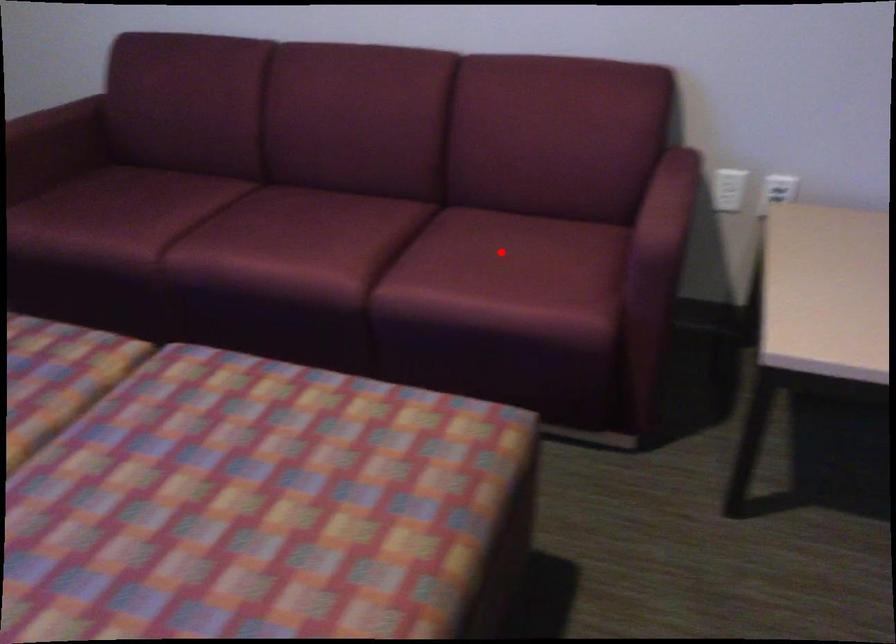
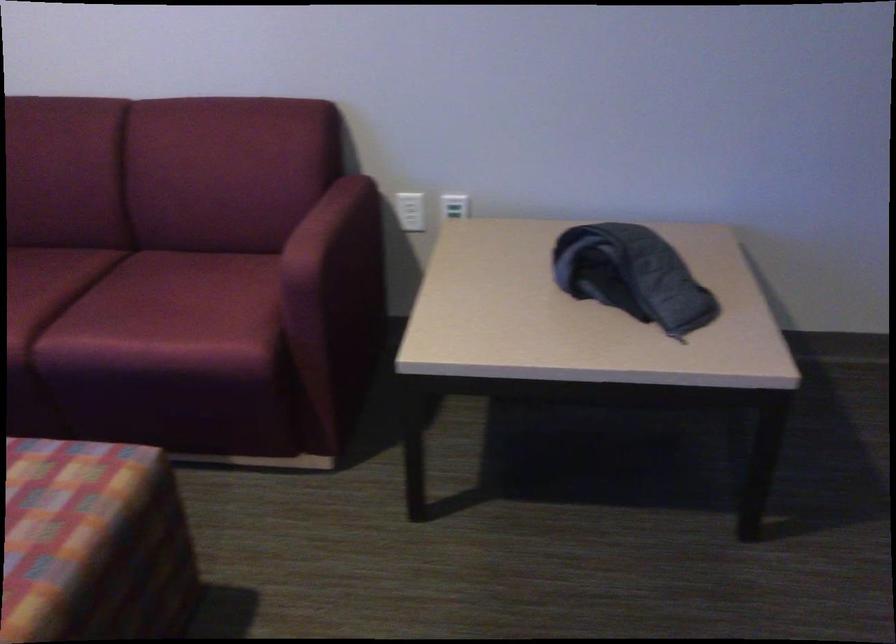
The point at the highlighted location is marked in the first image. Where is the corresponding point in the second image?

(175, 290)